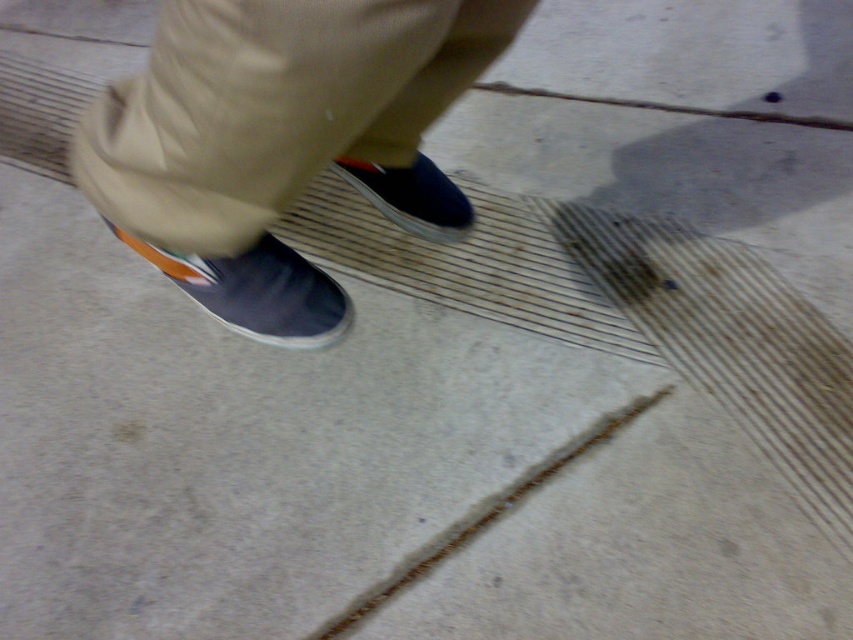
Question: Which of the following is the farthest from the observer?

Choices:
 (A) (137, 115)
 (B) (527, 470)
 (C) (751, 115)
 (D) (337, 291)

Answer: (C)

Question: Which point is farther from the camera taking this photo?

Choices:
 (A) (386, 595)
 (B) (370, 172)
 (C) (361, 36)
 (D) (727, 113)

Answer: (D)

Question: Is matte blue slip-on shoe at lower left smaller than shiny blue slip-on shoe at center?

Choices:
 (A) yes
 (B) no

Answer: (B)

Question: Which object is positioned farthest from the khaki cotton pants at center?

Choices:
 (A) brown concrete crack at upper center
 (B) brown rough concrete crack at lower center

Answer: (A)

Question: Can you confirm if shiny blue slip-on shoe at center is positioned above brown concrete crack at upper center?

Choices:
 (A) yes
 (B) no

Answer: (B)

Question: Does matte blue slip-on shoe at lower left appear under brown concrete crack at upper center?

Choices:
 (A) no
 (B) yes

Answer: (B)